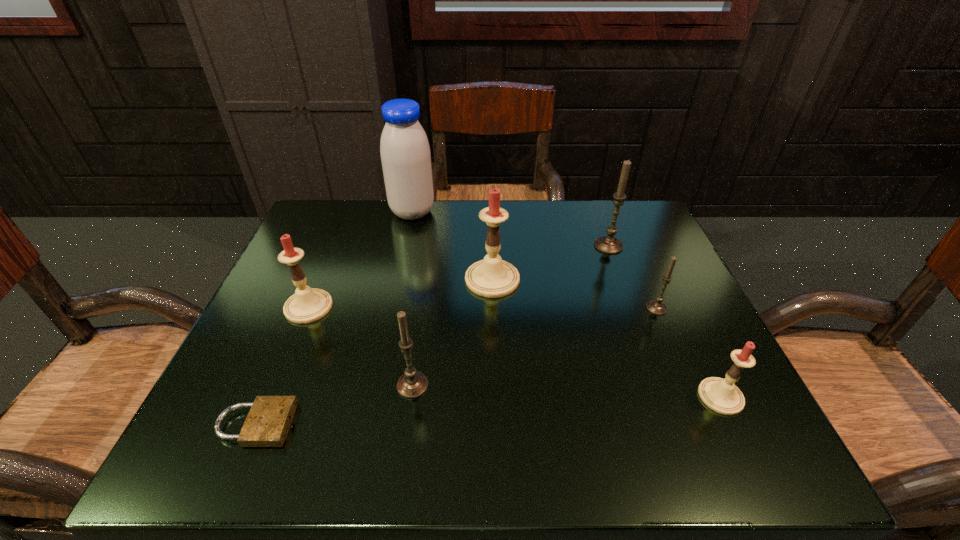
This screenshot has width=960, height=540. In order to click on free space that satisfies the following two spatial constraints: 1. on the back side of the leftmost gray candle; 2. on the left side of the smallest gray candle in this screenshot , I will do `click(423, 308)`.

The width and height of the screenshot is (960, 540). Find the location of `vacant area in the image that satisfies the following two spatial constraints: 1. on the front side of the second nearest gray candle; 2. on the left side of the farthest candle`. vacant area in the image that satisfies the following two spatial constraints: 1. on the front side of the second nearest gray candle; 2. on the left side of the farthest candle is located at coordinates (631, 308).